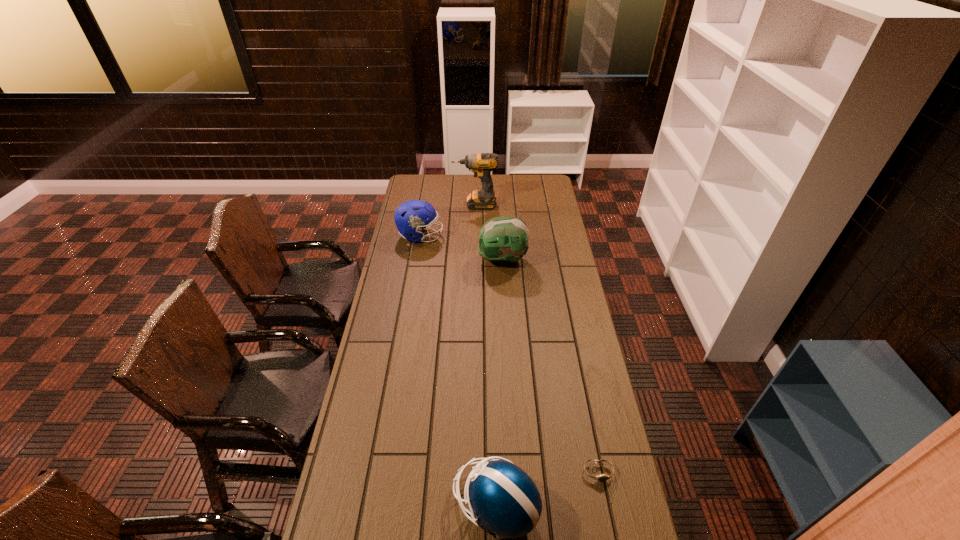
You are a GUI agent. You are given a task and a screenshot of the screen. Output one action in this format:
    pyautogui.click(x=<x>, y=<y>)
    Task: Click on the vacant point located between the fourth nearest object and the tallest object
    This screenshot has height=540, width=960.
    Given the screenshot: What is the action you would take?
    click(x=447, y=220)

Locate an element on the screen. The width and height of the screenshot is (960, 540). free area in between the drill and the farthest football helmet is located at coordinates (447, 220).

Find the location of `free space between the drill and the shortest object`. free space between the drill and the shortest object is located at coordinates (537, 338).

Find the location of a particular element. The width and height of the screenshot is (960, 540). vacant area that lies between the watch and the second farthest football helmet is located at coordinates (550, 366).

In order to click on the third closest object to the nearest football helmet in this screenshot , I will do [x=413, y=216].

Choose which object is the fourth nearest neighbor to the leftmost object. Please provide its 2D coordinates. Your answer should be formatted as a tuple, i.e. [(x, y)], where the tuple contains the x and y coordinates of a point satisfying the conditions above.

[(603, 477)]

This screenshot has width=960, height=540. I want to click on the closest football helmet to the nearest football helmet, so click(x=504, y=239).

I want to click on football helmet that is the closest to the farthest football helmet, so (504, 239).